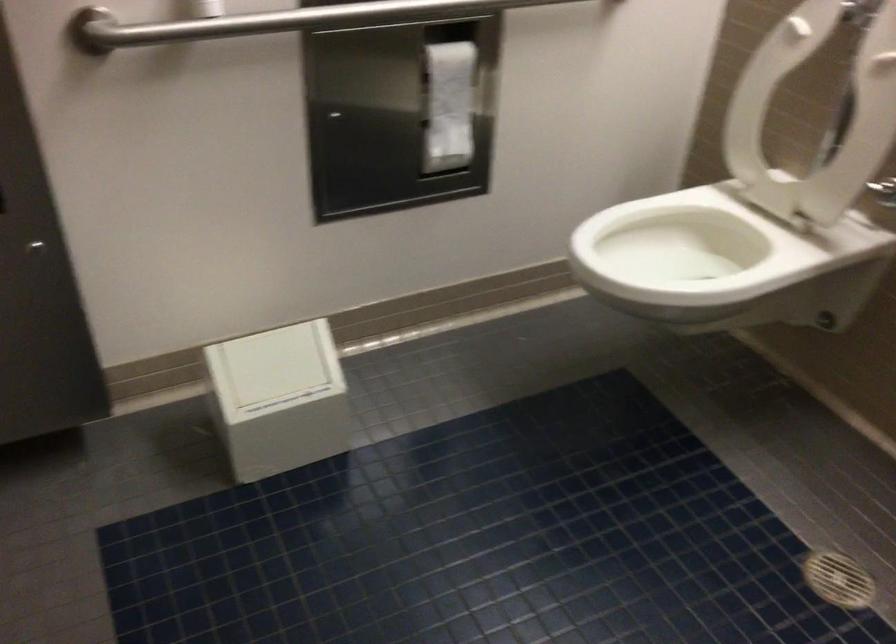
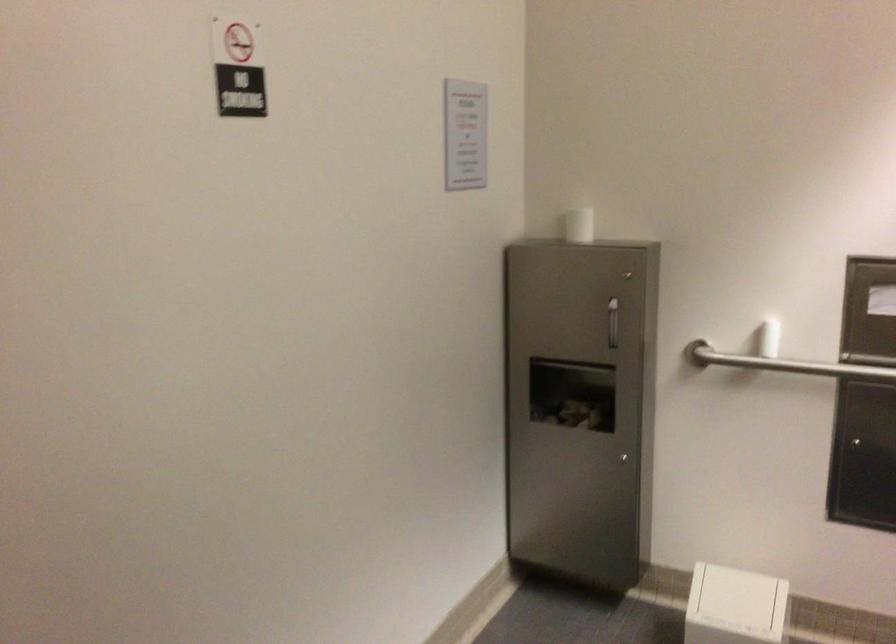
Question: Based on the continuous images, in which direction is the camera rotating? Reply with the corresponding letter.

Choices:
 (A) Left
 (B) Right
 (C) Up
 (D) Down

Answer: (A)